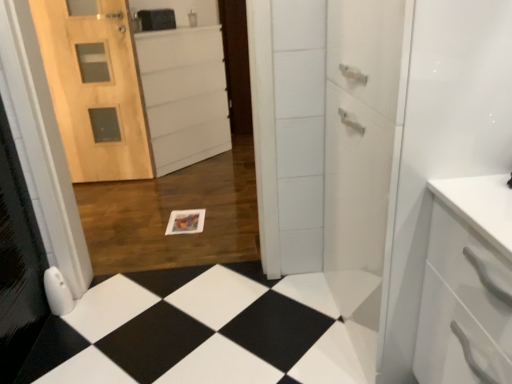
Question: Should I look upward or downward to see white matte cabinet at center?

Choices:
 (A) up
 (B) down

Answer: (A)

Question: Does white matte cabinet at center lie behind black glossy tile at lower center?

Choices:
 (A) yes
 (B) no

Answer: (A)

Question: Considering the relative sizes of white matte cabinet at center and black glossy tile at lower center in the image provided, is white matte cabinet at center thinner than black glossy tile at lower center?

Choices:
 (A) no
 (B) yes

Answer: (B)

Question: Can you confirm if white matte cabinet at center is bigger than black glossy tile at lower center?

Choices:
 (A) no
 (B) yes

Answer: (B)

Question: Could you tell me if white matte cabinet at center is facing black glossy tile at lower center?

Choices:
 (A) no
 (B) yes

Answer: (A)

Question: Is white matte cabinet at center facing away from black glossy tile at lower center?

Choices:
 (A) no
 (B) yes

Answer: (A)

Question: Considering the relative sizes of white matte cabinet at center and black glossy tile at lower center in the image provided, is white matte cabinet at center wider than black glossy tile at lower center?

Choices:
 (A) yes
 (B) no

Answer: (B)

Question: Is black glossy tile at lower center wider than white matte cabinet at center?

Choices:
 (A) yes
 (B) no

Answer: (A)

Question: Is the depth of black glossy tile at lower center less than that of white matte cabinet at center?

Choices:
 (A) yes
 (B) no

Answer: (A)

Question: Is black glossy tile at lower center touching white matte cabinet at center?

Choices:
 (A) yes
 (B) no

Answer: (B)

Question: Is black glossy tile at lower center to the left of white matte cabinet at center from the viewer's perspective?

Choices:
 (A) no
 (B) yes

Answer: (A)

Question: Is black glossy tile at lower center smaller than white matte cabinet at center?

Choices:
 (A) yes
 (B) no

Answer: (A)

Question: From the image's perspective, does black glossy tile at lower center appear lower than white matte cabinet at center?

Choices:
 (A) yes
 (B) no

Answer: (A)

Question: Is white matte cabinet at center positioned in front of natural wood door at left?

Choices:
 (A) yes
 (B) no

Answer: (B)